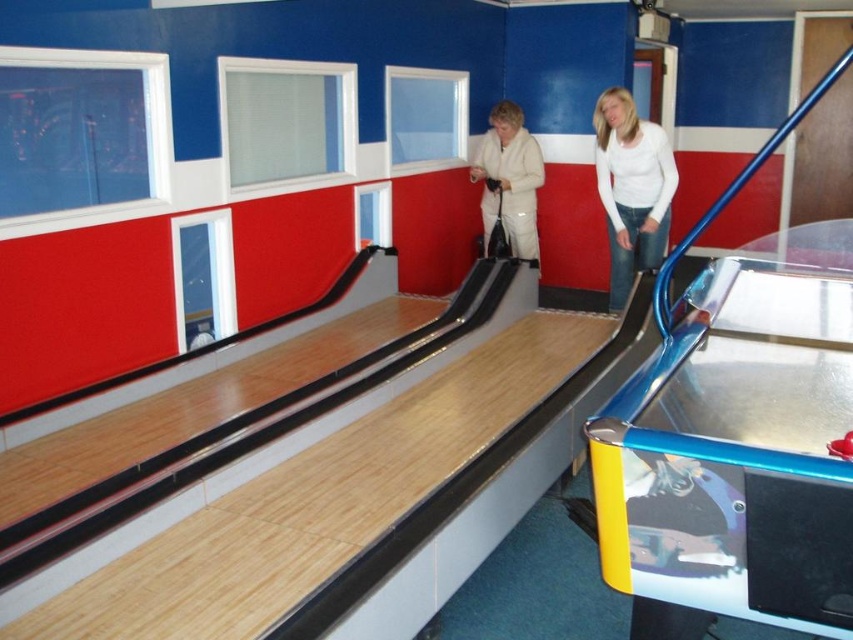
Which is above, white matte shirt at upper right or white fleece jacket at center?

white fleece jacket at center is higher up.

Is white matte shirt at upper right closer to camera compared to white fleece jacket at center?

Yes, it is in front of white fleece jacket at center.

Where is `white matte shirt at upper right`? The width and height of the screenshot is (853, 640). white matte shirt at upper right is located at coordinates (631, 188).